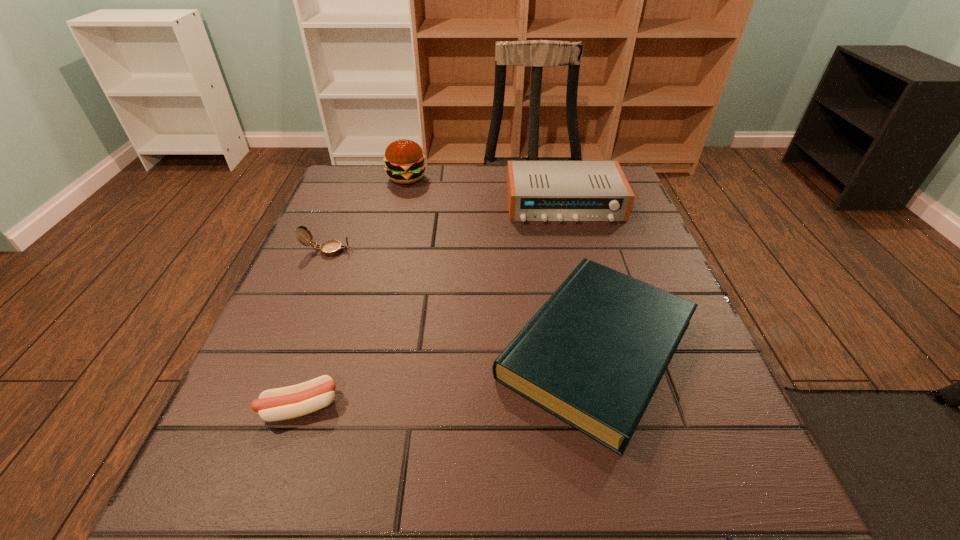
The width and height of the screenshot is (960, 540). Find the location of `vacant point at the near edge`. vacant point at the near edge is located at coordinates (631, 524).

What are the coordinates of `vacant space at the left edge` in the screenshot? It's located at (345, 275).

This screenshot has height=540, width=960. In order to click on vacant space at the right edge of the desktop in this screenshot , I will do `click(683, 339)`.

Where is `free space at the far left corner of the desktop`? This screenshot has width=960, height=540. free space at the far left corner of the desktop is located at coordinates (373, 191).

Locate an element on the screen. vacant space at the near left corner of the desktop is located at coordinates (217, 487).

In the image, there is a desktop. In order to click on vacant space at the near right corner in this screenshot , I will do `click(660, 481)`.

Identify the location of free spot between the shortest object and the compass. (314, 329).

Locate an element on the screen. This screenshot has width=960, height=540. free point between the compass and the radio receiver is located at coordinates (446, 227).

You are a GUI agent. You are given a task and a screenshot of the screen. Output one action in this format:
    pyautogui.click(x=<x>, y=<y>)
    Task: Click on the free space between the tallest object and the sausage
    This screenshot has width=960, height=540.
    Given the screenshot: What is the action you would take?
    pyautogui.click(x=353, y=292)

The image size is (960, 540). I want to click on unoccupied position between the third farthest object and the sausage, so click(314, 329).